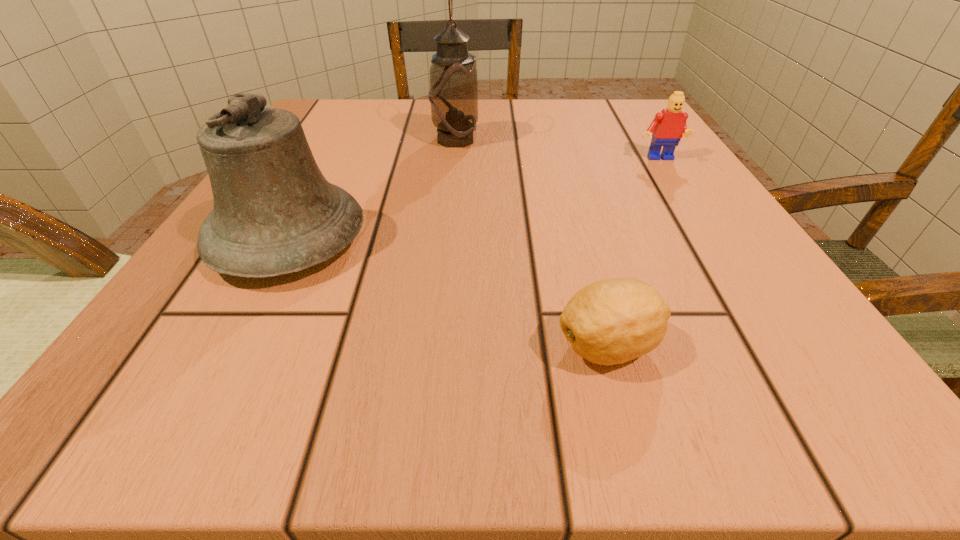
Locate an element on the screen. Image resolution: width=960 pixels, height=540 pixels. free point between the second object from left to right and the nearest object is located at coordinates (532, 243).

Find the location of a particular element. The height and width of the screenshot is (540, 960). vacant space in between the farthest object and the second tallest object is located at coordinates (372, 190).

Identify the location of free space between the tallest object and the third farthest object. The image size is (960, 540). click(x=372, y=190).

This screenshot has width=960, height=540. Identify the location of vacant point located between the second shortest object and the third shortest object. (474, 200).

Locate an element on the screen. This screenshot has width=960, height=540. unoccupied area between the Lego and the bell is located at coordinates (474, 200).

Locate an element on the screen. This screenshot has height=540, width=960. free area in between the third nearest object and the bell is located at coordinates (474, 200).

Locate which object ranks second in proximity to the nearest object. Please provide its 2D coordinates. Your answer should be formatted as a tuple, i.e. [(x, y)], where the tuple contains the x and y coordinates of a point satisfying the conditions above.

[(668, 126)]

The image size is (960, 540). What are the coordinates of `object that stands as the third closest to the bell` in the screenshot? It's located at (668, 126).

Where is `free spot that satisfies the following two spatial constraints: 1. on the front-facing side of the rightmost object; 2. at the stem end of the third object from left to right`? free spot that satisfies the following two spatial constraints: 1. on the front-facing side of the rightmost object; 2. at the stem end of the third object from left to right is located at coordinates (777, 346).

You are a GUI agent. You are given a task and a screenshot of the screen. Output one action in this format:
    pyautogui.click(x=<x>, y=<y>)
    Task: Click on the vacant space that satisfies the following two spatial constraints: 1. on the front-facing side of the second shortest object; 2. at the stem end of the lemon
    This screenshot has height=540, width=960.
    Given the screenshot: What is the action you would take?
    pyautogui.click(x=777, y=346)